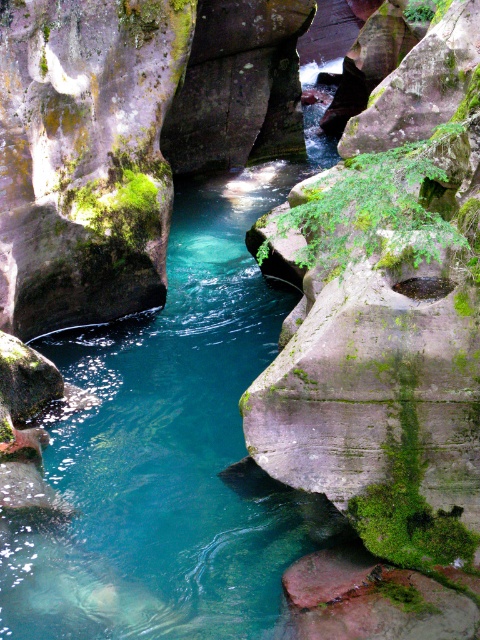
Can you confirm if clear water at center is positioned to the left of green mossy rock at left?

In fact, clear water at center is to the right of green mossy rock at left.

Does clear water at center appear over green mossy rock at left?

Incorrect, clear water at center is not positioned above green mossy rock at left.

Which is behind, point (204, 467) or point (72, 8)?

The point (72, 8) is behind.

This screenshot has width=480, height=640. Find the location of `clear water at center`. clear water at center is located at coordinates (168, 449).